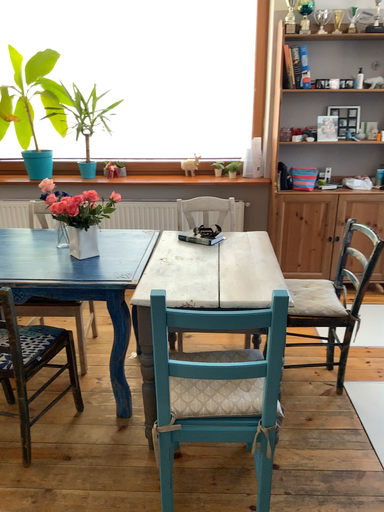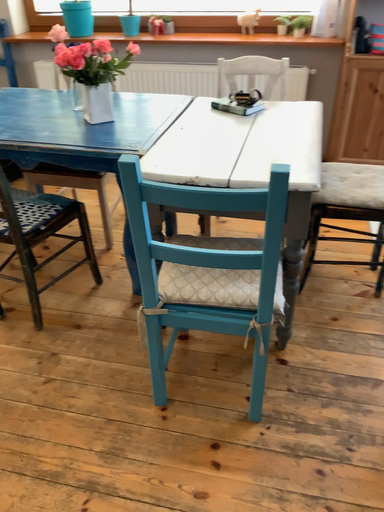
Question: Which way did the camera rotate in the video?

Choices:
 (A) rotated left
 (B) rotated right

Answer: (A)